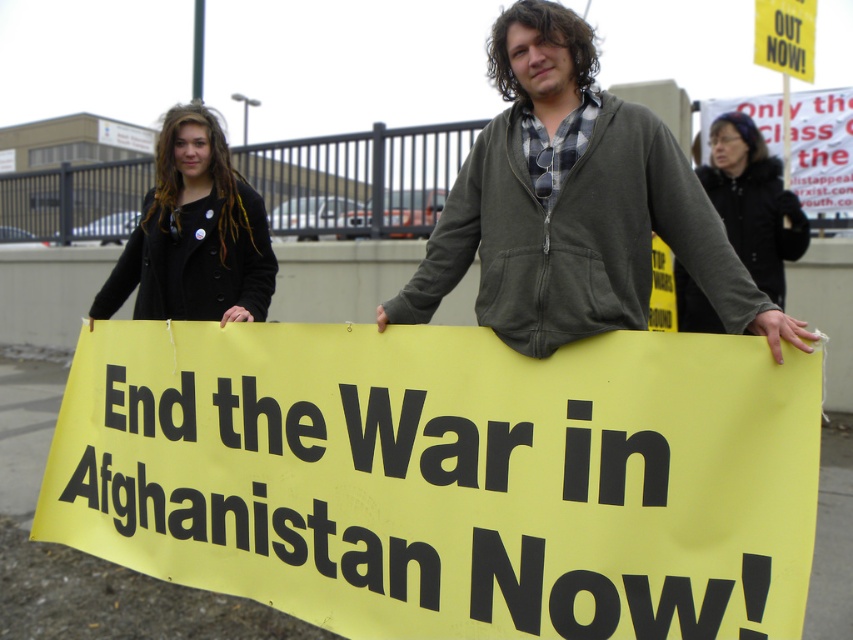
You are a photographer trying to capture a clear shot of the yellow paper sign at center and the black fur coat at upper right. Based on their positions, which object should you focus on first to ensure both are in frame?

The yellow paper sign at center is to the left of black fur coat at upper right, so you should focus on the black fur coat at upper right first to ensure both are in frame.